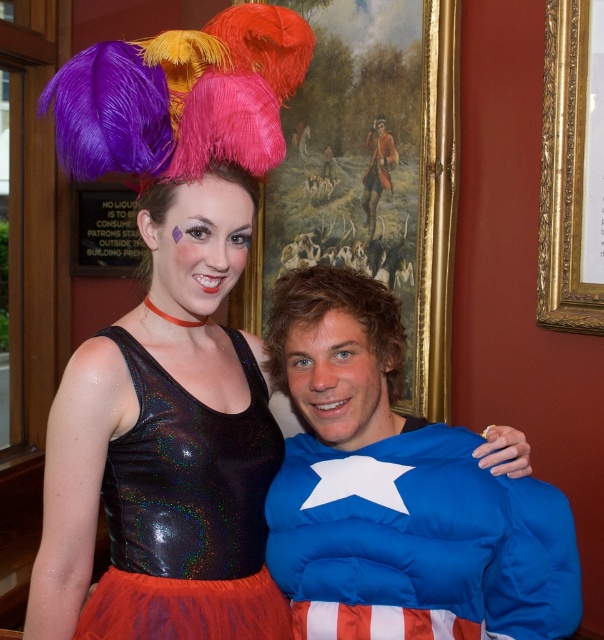
Question: Which of the following is the farthest from the observer?

Choices:
 (A) blue padded costume at center
 (B) holographic sequin leotard at center

Answer: (B)

Question: From the image, what is the correct spatial relationship of blue padded costume at center in relation to holographic sequin leotard at center?

Choices:
 (A) right
 (B) left

Answer: (A)

Question: Which of the following is the closest to the observer?

Choices:
 (A) (402, 545)
 (B) (173, 412)

Answer: (A)

Question: Is blue padded costume at center below holographic sequin leotard at center?

Choices:
 (A) no
 (B) yes

Answer: (B)

Question: Which object appears closest to the camera in this image?

Choices:
 (A) blue padded costume at center
 (B) holographic sequin leotard at center

Answer: (A)

Question: Is blue padded costume at center closer to the viewer compared to holographic sequin leotard at center?

Choices:
 (A) no
 (B) yes

Answer: (B)